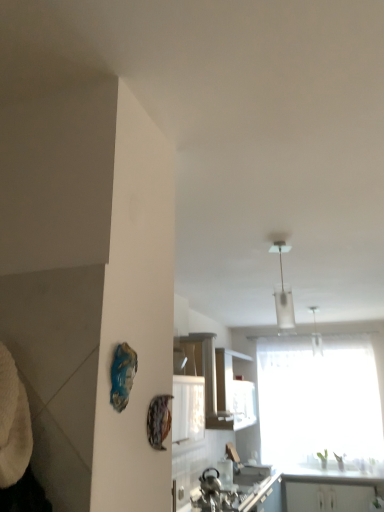
Question: Is point (306, 487) positioned closer to the camera than point (264, 482)?

Choices:
 (A) farther
 (B) closer

Answer: (A)

Question: Is white glossy cabinet at lower right, the first cabinetry in the bottom-to-top sequence, taller or shorter than metallic silver sink at lower center?

Choices:
 (A) tall
 (B) short

Answer: (B)

Question: Which object is positioned closest to the white glossy cabinet at center, arranged as the first cabinetry when viewed from the top?

Choices:
 (A) metallic silver sink at lower center
 (B) white glass pendant light at upper center
 (C) transparent fabric window at center
 (D) white glossy cabinet at lower right, the 2th cabinetry when ordered from front to back
 (E) white glossy countertop at lower right

Answer: (A)

Question: Estimate the real-world distances between objects in this image. Which object is farther from the white glass pendant light at upper center?

Choices:
 (A) white glossy cabinet at center, arranged as the first cabinetry when viewed from the top
 (B) white glossy countertop at lower right
 (C) metallic silver sink at lower center
 (D) white glossy cabinet at lower right, placed as the second cabinetry when sorted from top to bottom
 (E) transparent fabric window at center

Answer: (D)